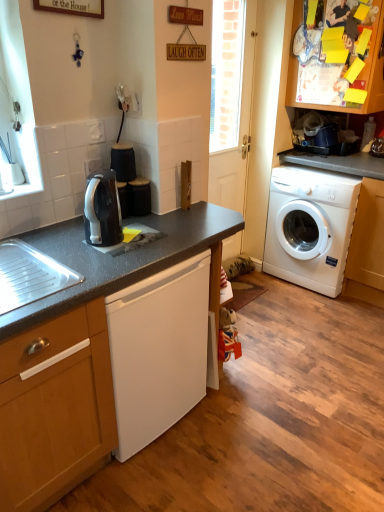
The height and width of the screenshot is (512, 384). Find the location of `vacant space to the right of black granite countertop at center`. vacant space to the right of black granite countertop at center is located at coordinates (286, 393).